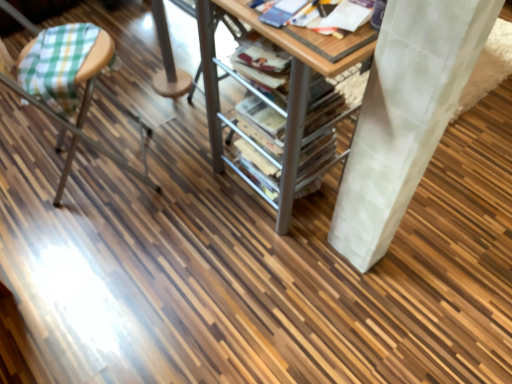
You are a GUI agent. You are given a task and a screenshot of the screen. Output one action in this format:
    pyautogui.click(x=<x>, y=<y>)
    Task: Click on the free space between green plaid fabric stool at left and wooden table at center
    
    Given the screenshot: What is the action you would take?
    pyautogui.click(x=170, y=187)